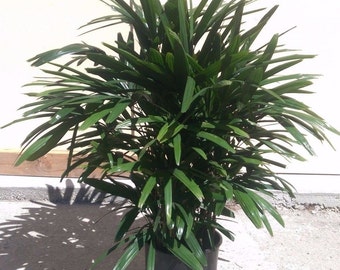
Identify the location of plant pot. point(163,267).